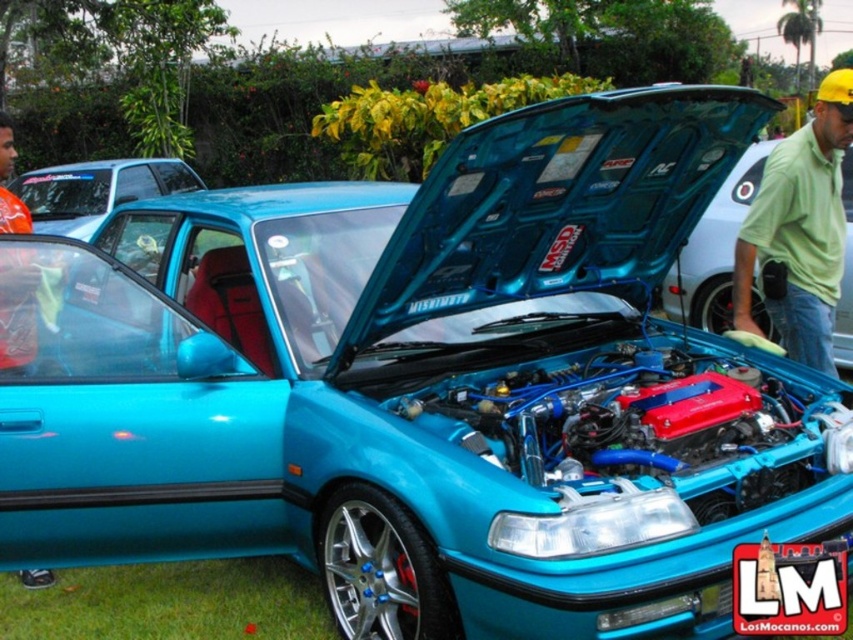
You are a photographer at a car show and want to capture both the green cotton shirt at upper right and the orange fabric shirt at left in a single photo. Which shirt will appear closer to the camera in the photo?

The green cotton shirt at upper right will appear closer to the camera because the orange fabric shirt at left is behind it.

From the picture: You are a photographer taking a picture of the car. You notice two points on the car, one at point (775, 241) and another at point (4, 168). Which point will appear larger in your photo?

Point (775, 241) is closer to the camera than point (4, 168), so it will appear larger in the photo.